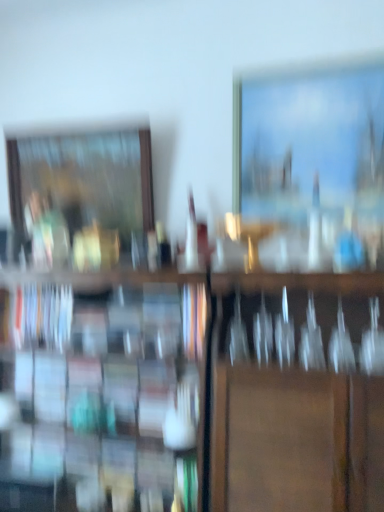
Question: Is hardcover book at left to the right of matte wooden picture frame at upper right, acting as the 1th picture frame starting from the front, from the viewer's perspective?

Choices:
 (A) yes
 (B) no

Answer: (B)

Question: From the image's perspective, is hardcover book at left on top of matte wooden picture frame at upper right, acting as the 1th picture frame starting from the front?

Choices:
 (A) no
 (B) yes

Answer: (A)

Question: Is hardcover book at left closer to the viewer compared to matte wooden picture frame at upper right, acting as the 1th picture frame starting from the front?

Choices:
 (A) no
 (B) yes

Answer: (A)

Question: From a real-world perspective, is hardcover book at left positioned over matte wooden picture frame at upper right, the 1th picture frame from the right, based on gravity?

Choices:
 (A) no
 (B) yes

Answer: (A)

Question: Is hardcover book at left positioned behind matte wooden picture frame at upper right, acting as the 1th picture frame starting from the front?

Choices:
 (A) no
 (B) yes

Answer: (B)

Question: Does point (51, 194) appear closer or farther from the camera than point (248, 445)?

Choices:
 (A) farther
 (B) closer

Answer: (A)

Question: From a real-world perspective, relative to wooden bookshelf at center, is wooden picture frame at left, arranged as the first picture frame when viewed from the back, vertically above or below?

Choices:
 (A) above
 (B) below

Answer: (A)

Question: Considering their positions, is wooden picture frame at left, the 2th picture frame viewed from the front, located in front of or behind wooden bookshelf at center?

Choices:
 (A) front
 (B) behind

Answer: (B)

Question: Is wooden picture frame at left, the 2th picture frame from the right, spatially inside wooden bookshelf at center, or outside of it?

Choices:
 (A) inside
 (B) outside

Answer: (B)

Question: Is wooden picture frame at left, arranged as the first picture frame when viewed from the back, in front of or behind hardcover book at left in the image?

Choices:
 (A) front
 (B) behind

Answer: (B)

Question: Is wooden picture frame at left, arranged as the first picture frame when viewed from the back, wider or thinner than hardcover book at left?

Choices:
 (A) thin
 (B) wide

Answer: (A)

Question: In terms of height, does wooden picture frame at left, the 2th picture frame from the right, look taller or shorter compared to hardcover book at left?

Choices:
 (A) short
 (B) tall

Answer: (B)

Question: Looking at the image, does wooden picture frame at left, arranged as the first picture frame when viewed from the back, seem bigger or smaller compared to hardcover book at left?

Choices:
 (A) big
 (B) small

Answer: (A)

Question: Is wooden picture frame at left, the 2th picture frame viewed from the front, in front of or behind matte wooden picture frame at upper right, which is the 2th picture frame in back-to-front order, in the image?

Choices:
 (A) behind
 (B) front

Answer: (A)

Question: In terms of width, does wooden picture frame at left, the 1th picture frame in the left-to-right sequence, look wider or thinner when compared to matte wooden picture frame at upper right, acting as the 1th picture frame starting from the front?

Choices:
 (A) wide
 (B) thin

Answer: (A)